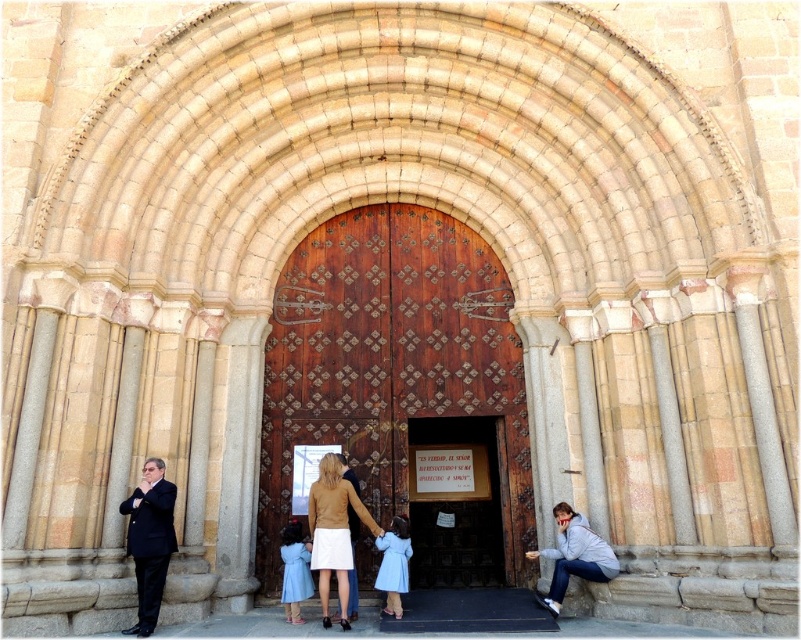
Which is in front, point (380, 580) or point (348, 612)?

Point (348, 612)

Can you confirm if light blue fabric dress at center is positioned below dark brown suit at center?

Indeed, light blue fabric dress at center is positioned under dark brown suit at center.

Is point (393, 588) positioned in front of point (356, 536)?

Yes, point (393, 588) is in front of point (356, 536).

This screenshot has height=640, width=801. What are the coordinates of `light blue fabric dress at center` in the screenshot? It's located at (392, 563).

Which of these two, wooden at center or light blue fabric dress at center, stands taller?

wooden at center

Does wooden at center appear under light blue fabric dress at center?

Incorrect, wooden at center is not positioned below light blue fabric dress at center.

Is point (512, 509) in front of point (389, 548)?

No, it is not.

You are a GUI agent. You are given a task and a screenshot of the screen. Output one action in this format:
    pyautogui.click(x=<x>, y=<y>)
    Task: Click on the wooden at center
    
    Given the screenshot: What is the action you would take?
    pyautogui.click(x=392, y=364)

Who is lower down, wooden at center or dark brown suit at center?

dark brown suit at center is lower down.

Between point (494, 369) and point (355, 516), which one is positioned in front?

Point (355, 516)

Who is more forward, (356, 397) or (355, 589)?

Point (355, 589) is more forward.

The image size is (801, 640). I want to click on wooden at center, so click(x=392, y=364).